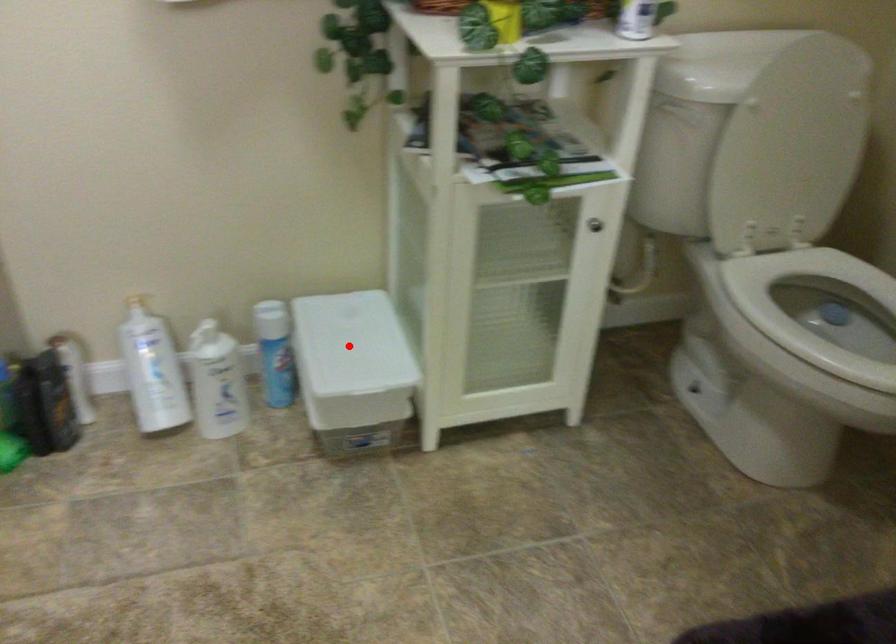
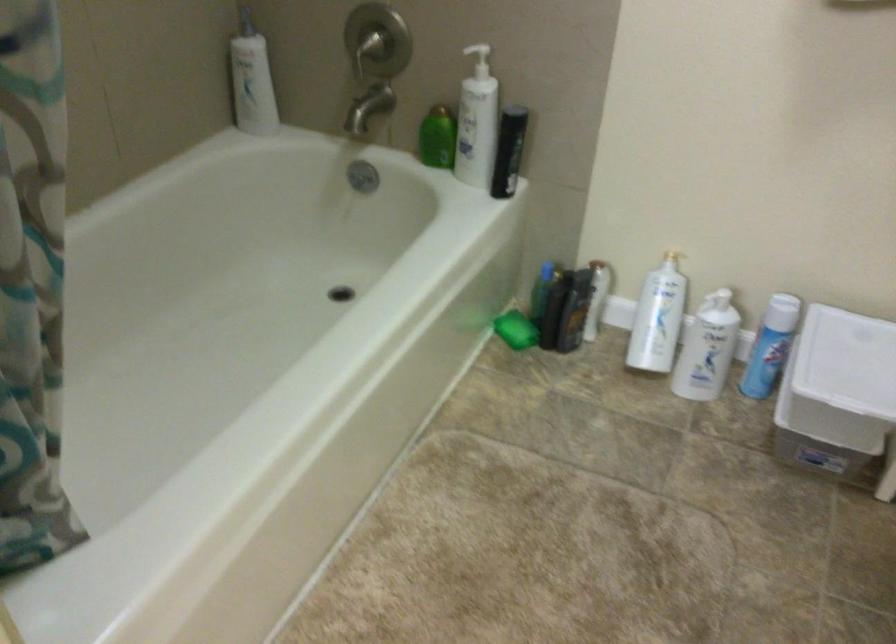
Where in the second image is the point corresponding to the highlighted location from the first image?

(847, 361)